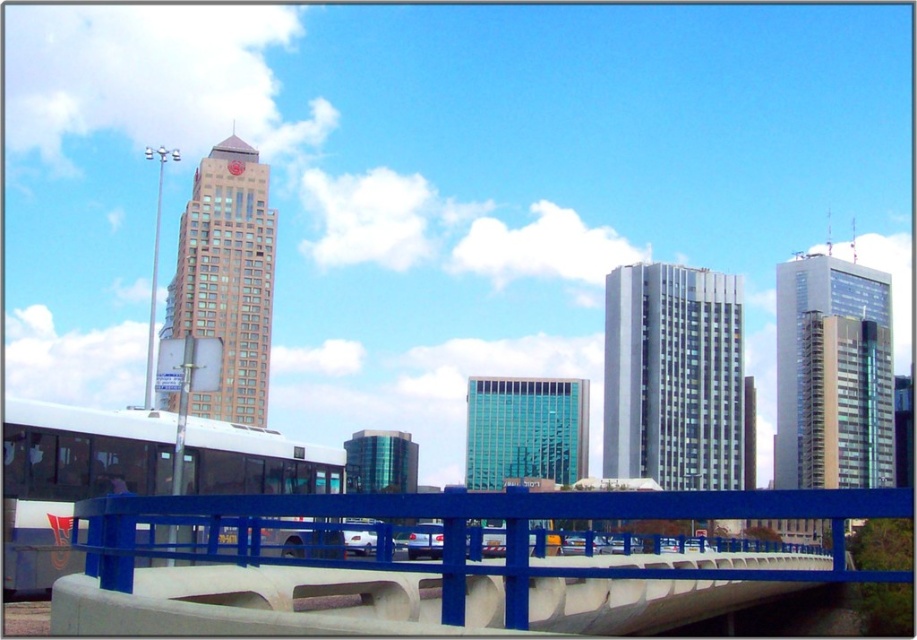
You are standing on the modern bridge with blue railing and concrete base in the foreground. You want to locate the silver glass skyscraper at right. According to the coordinates provided, where should you look relative to the bridge?

The silver glass skyscraper at right is located at coordinates point 0.586 on the x axis and 0.909 on the y axis relative to the bridge.

You are a drone operator planning to fly a drone from the blue metallic pedestrian bridge at center to the silver glass skyscraper at right. Based on the scene, which direction should you fly the drone to reach the skyscraper?

The blue metallic pedestrian bridge at center is positioned on the left side of the silver glass skyscraper at right, so you should fly the drone to the right to reach the skyscraper.